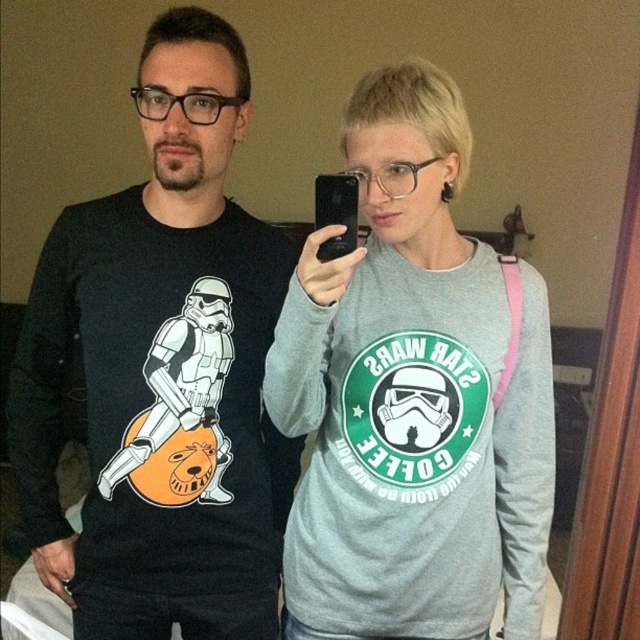
Question: Does black matte t-shirt at center appear under gray matte sweatshirt at center?

Choices:
 (A) no
 (B) yes

Answer: (A)

Question: Among these points, which one is nearest to the camera?

Choices:
 (A) (157, 244)
 (B) (326, 529)

Answer: (B)

Question: Is black matte t-shirt at center positioned before gray matte sweatshirt at center?

Choices:
 (A) no
 (B) yes

Answer: (A)

Question: Is black matte t-shirt at center smaller than gray matte sweatshirt at center?

Choices:
 (A) yes
 (B) no

Answer: (B)